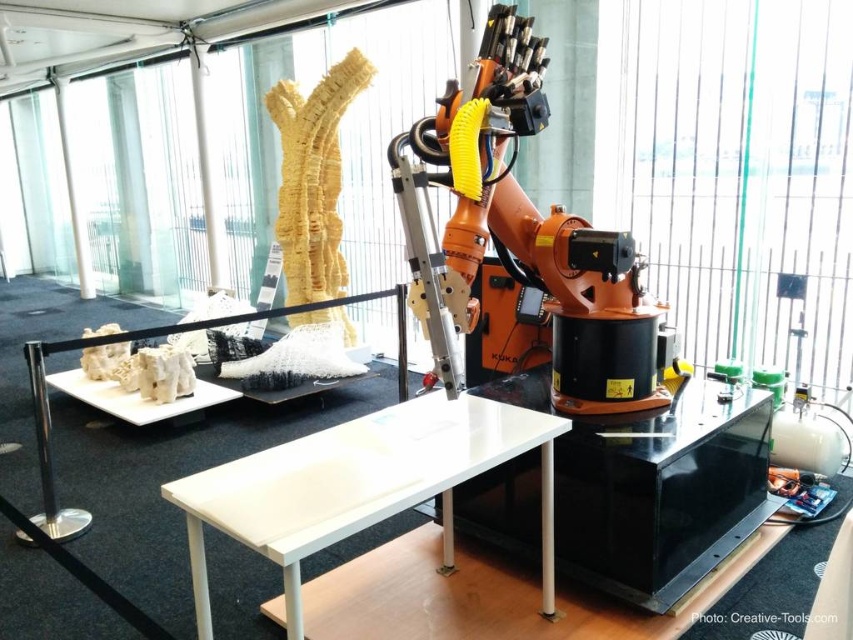
What is located at the coordinates point (660, 492) in the image?

The black glossy table at center is located at point (660, 492).

From the picture: You are a delivery robot that needs to transport a package that is 40 centimeters wide. You are in a workshop and see the black glossy table at center and the white glossy table at center. Can you fit the package between them?

The distance between the black glossy table at center and white glossy table at center is 44.00 centimeters. Since the package is 40 centimeters wide, it will fit between them with 4 centimeters of space remaining.

You are an engineer in a workshop and need to place a large equipment on the table. Which table, the black glossy table at center or the white glossy table at center, would you choose to place it on?

The black glossy table at center has a larger width than the white glossy table at center, so you should choose the black glossy table at center to place the large equipment on.